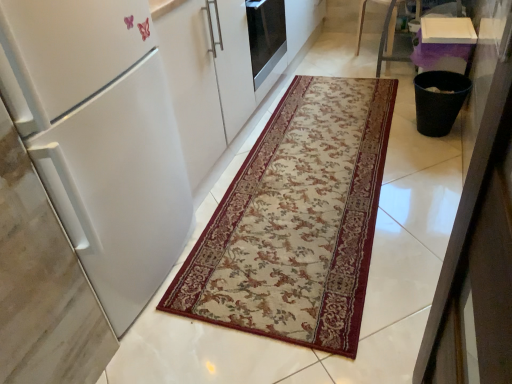
What do you see at coordinates (100, 139) in the screenshot? I see `white matte refrigerator at left` at bounding box center [100, 139].

What is the approximate width of white matte refrigerator at left?

26.09 inches.

This screenshot has height=384, width=512. Find the location of `white matte refrigerator at left`. white matte refrigerator at left is located at coordinates (100, 139).

Describe the element at coordinates (297, 221) in the screenshot. The height and width of the screenshot is (384, 512). I see `beige floral rug at center` at that location.

At what (x,y) coordinates should I click in order to perform the action: click on beige floral rug at center. Please return your answer as a coordinate pair (x, y). Looking at the image, I should click on (297, 221).

The image size is (512, 384). In order to click on white matte refrigerator at left in this screenshot , I will do `click(100, 139)`.

Considering the relative positions of white matte refrigerator at left and beige floral rug at center in the image provided, is white matte refrigerator at left to the left or to the right of beige floral rug at center?

Clearly, white matte refrigerator at left is on the left of beige floral rug at center in the image.

Is white matte refrigerator at left in front of beige floral rug at center?

Yes, white matte refrigerator at left is in front of beige floral rug at center.

Is point (122, 134) farther from viewer compared to point (245, 185)?

That is False.

Consider the image. From the image's perspective, which is below, white matte refrigerator at left or beige floral rug at center?

white matte refrigerator at left.

From a real-world perspective, is white matte refrigerator at left positioned above or below beige floral rug at center?

In terms of real-world spatial position, white matte refrigerator at left is above beige floral rug at center.

Which object is thinner, white matte refrigerator at left or beige floral rug at center?

white matte refrigerator at left.

Considering the relative sizes of white matte refrigerator at left and beige floral rug at center in the image provided, is white matte refrigerator at left shorter than beige floral rug at center?

In fact, white matte refrigerator at left may be taller than beige floral rug at center.

Who is bigger, white matte refrigerator at left or beige floral rug at center?

white matte refrigerator at left is bigger.

In the scene shown: Is white matte refrigerator at left completely or partially outside of beige floral rug at center?

white matte refrigerator at left is positioned outside beige floral rug at center.

Is white matte refrigerator at left not near beige floral rug at center?

No, white matte refrigerator at left is not far from beige floral rug at center.

Is white matte refrigerator at left aimed at beige floral rug at center?

No, white matte refrigerator at left is not turned towards beige floral rug at center.

Image resolution: width=512 pixels, height=384 pixels. Identify the location of mat that is under the white matte refrigerator at left (from a real-world perspective). (297, 221).

Which is more to the right, beige floral rug at center or white matte refrigerator at left?

From the viewer's perspective, beige floral rug at center appears more on the right side.

Relative to white matte refrigerator at left, is beige floral rug at center in front or behind?

beige floral rug at center is behind white matte refrigerator at left.

Between point (366, 217) and point (113, 102), which one is positioned behind?

The point (366, 217) is farther.

In the scene shown: From the image's perspective, which one is positioned higher, beige floral rug at center or white matte refrigerator at left?

From the image's view, beige floral rug at center is above.

Based on the photo, from a real-world perspective, who is located lower, beige floral rug at center or white matte refrigerator at left?

In real-world perspective, beige floral rug at center is lower.

Which of these two, beige floral rug at center or white matte refrigerator at left, is thinner?

Thinner between the two is white matte refrigerator at left.

Considering the relative sizes of beige floral rug at center and white matte refrigerator at left in the image provided, is beige floral rug at center shorter than white matte refrigerator at left?

Yes, beige floral rug at center is shorter than white matte refrigerator at left.

Which of these two, beige floral rug at center or white matte refrigerator at left, is bigger?

Bigger between the two is white matte refrigerator at left.

Could white matte refrigerator at left be considered to be inside beige floral rug at center?

No, beige floral rug at center does not contain white matte refrigerator at left.

Are beige floral rug at center and white matte refrigerator at left far apart?

That's not correct — beige floral rug at center is a little close to white matte refrigerator at left.

Could you tell me if beige floral rug at center is facing white matte refrigerator at left?

No, beige floral rug at center is not turned towards white matte refrigerator at left.

How much distance is there between beige floral rug at center and white matte refrigerator at left?

25.42 inches.

The image size is (512, 384). In order to click on mat lying on the right of white matte refrigerator at left in this screenshot , I will do `click(297, 221)`.

Where is `refrigerator below the beige floral rug at center (from the image's perspective)`? Image resolution: width=512 pixels, height=384 pixels. refrigerator below the beige floral rug at center (from the image's perspective) is located at coordinates (100, 139).

Image resolution: width=512 pixels, height=384 pixels. Find the location of `mat behind the white matte refrigerator at left`. mat behind the white matte refrigerator at left is located at coordinates (297, 221).